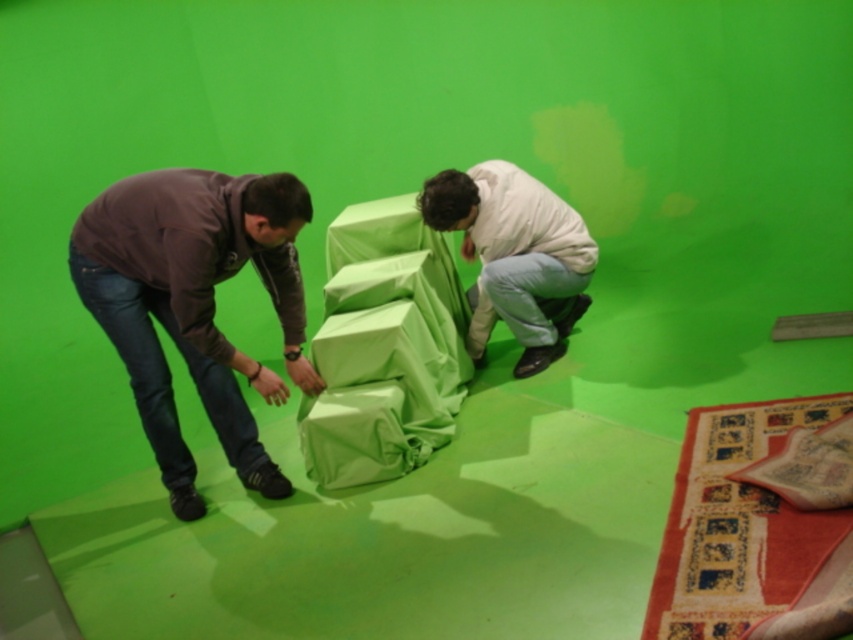
Question: Can you confirm if matte brown hoodie at left is wider than light beige fabric-covered object at center?

Choices:
 (A) no
 (B) yes

Answer: (A)

Question: Does matte brown hoodie at left appear on the left side of light beige fabric-covered object at center?

Choices:
 (A) yes
 (B) no

Answer: (A)

Question: Among these points, which one is nearest to the camera?

Choices:
 (A) (498, 192)
 (B) (103, 307)

Answer: (B)

Question: Among these objects, which one is nearest to the camera?

Choices:
 (A) light beige fabric-covered object at center
 (B) matte brown hoodie at left

Answer: (B)

Question: Which point is farther to the camera?

Choices:
 (A) matte brown hoodie at left
 (B) light beige fabric-covered object at center

Answer: (B)

Question: Is matte brown hoodie at left thinner than light beige fabric-covered object at center?

Choices:
 (A) no
 (B) yes

Answer: (B)